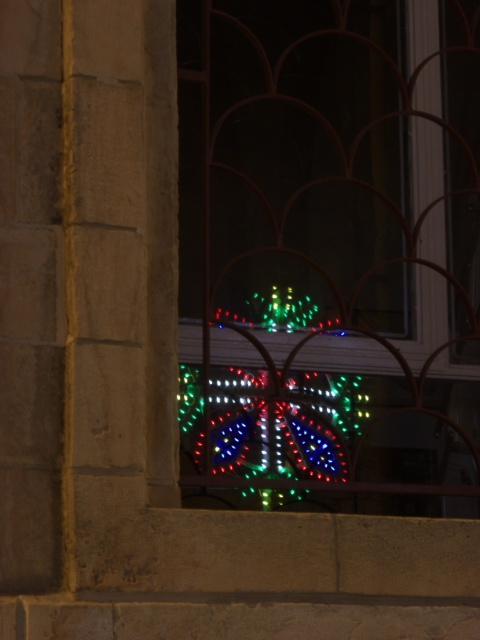
Question: Which point is closer to the camera?

Choices:
 (A) (331, 422)
 (B) (195, 129)

Answer: (A)

Question: Is led lights at center to the left of illuminated plastic lights at center from the viewer's perspective?

Choices:
 (A) no
 (B) yes

Answer: (A)

Question: Which object appears closest to the camera in this image?

Choices:
 (A) illuminated plastic lights at center
 (B) led lights at center

Answer: (B)

Question: Does led lights at center appear over illuminated plastic lights at center?

Choices:
 (A) yes
 (B) no

Answer: (A)

Question: Which point is closer to the camera taking this photo?

Choices:
 (A) click(321, 292)
 (B) click(216, 497)

Answer: (B)

Question: Is led lights at center closer to the viewer compared to illuminated plastic lights at center?

Choices:
 (A) yes
 (B) no

Answer: (A)